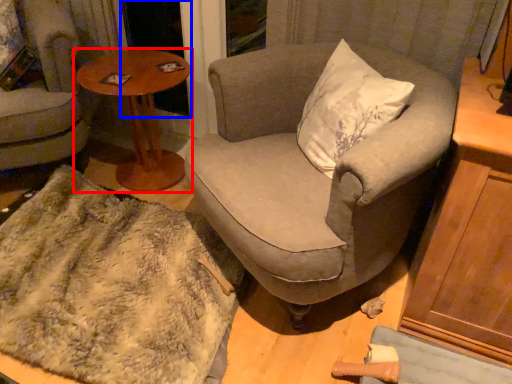
Question: Which of the following is the closest to the observer, table (highlighted by a red box) or screen door (highlighted by a blue box)?

Choices:
 (A) table
 (B) screen door

Answer: (A)